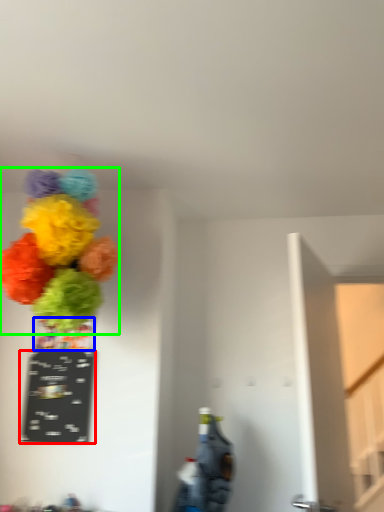
Question: Based on their relative distances, which object is farther from writing (highlighted by a red box)? Choose from vase (highlighted by a blue box) and flower (highlighted by a green box).

Choices:
 (A) vase
 (B) flower

Answer: (B)